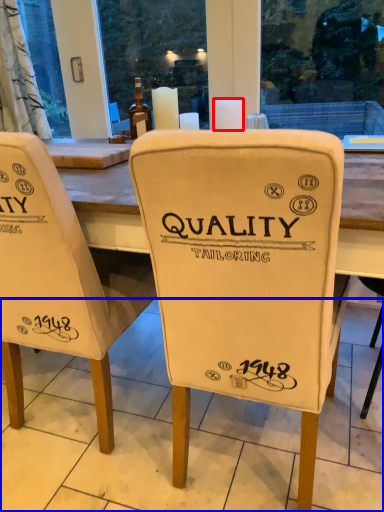
Question: Among these objects, which one is nearest to the camera, candle (highlighted by a red box) or tile (highlighted by a blue box)?

Choices:
 (A) candle
 (B) tile

Answer: (B)